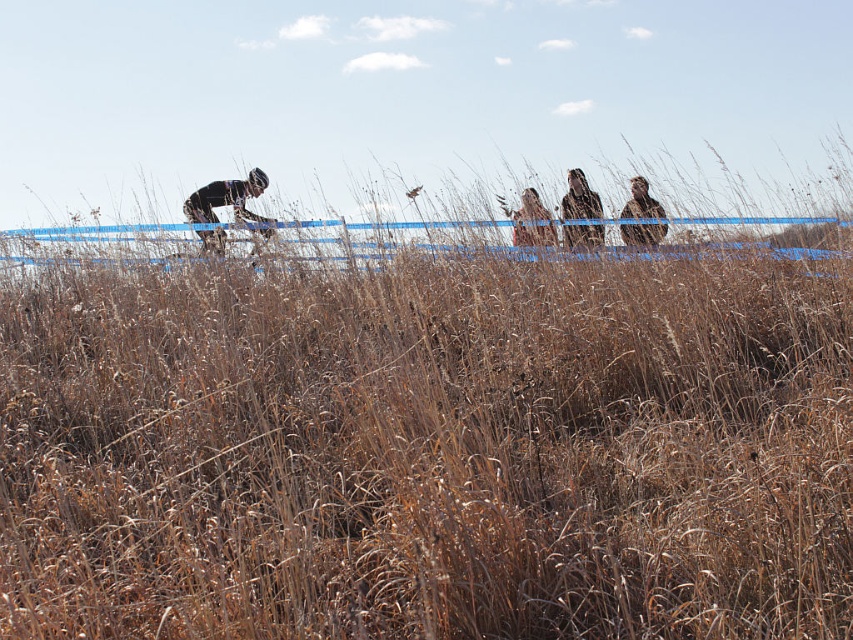
You are a photographer trying to capture the spectators at the event. You notice the dark brown leather jacket at upper center and the light brown hair at upper center. Which object is positioned higher in the image?

The dark brown leather jacket at upper center is located above the light brown hair at upper center, so it is positioned higher in the image.

You are a photographer trying to capture both the dark brown leather jacket at upper center and the brown fur coat at upper center in the same frame. Which jacket should you focus on first to ensure both are in the frame?

You should focus on the dark brown leather jacket at upper center first because it is larger and will be easier to frame, ensuring the smaller brown fur coat at upper center also fits into the shot.